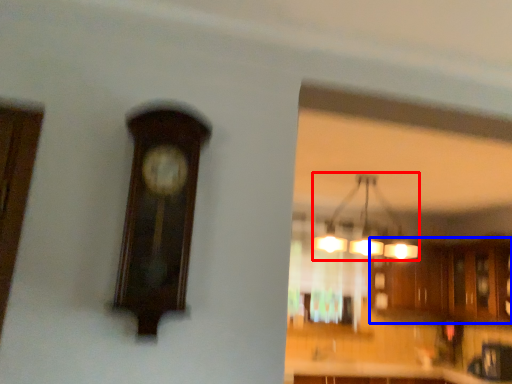
Question: Which object appears farthest to the camera in this image, lamp (highlighted by a red box) or cabinetry (highlighted by a blue box)?

Choices:
 (A) lamp
 (B) cabinetry

Answer: (B)